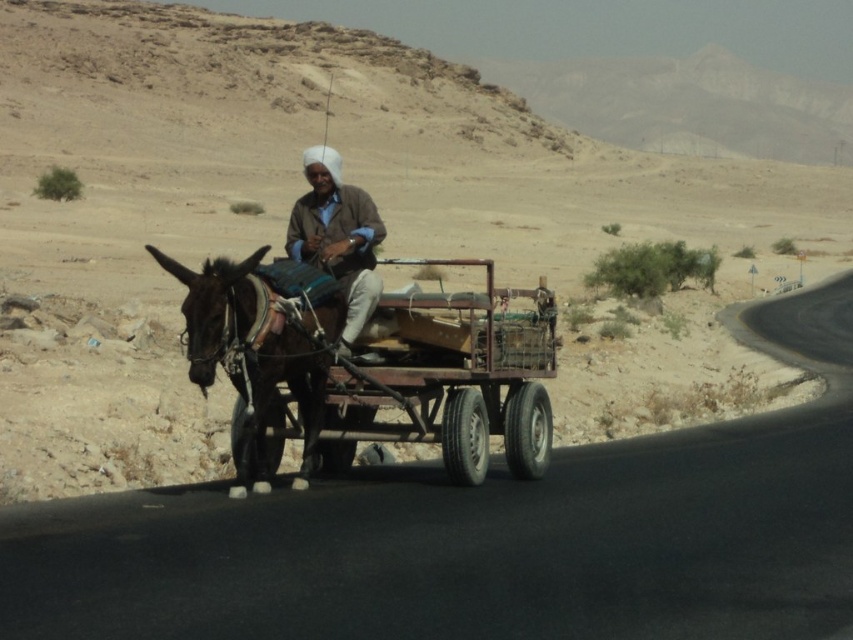
Question: Is shiny black horse at center behind brown woolen sweater at center?

Choices:
 (A) yes
 (B) no

Answer: (B)

Question: Which of these objects is positioned closest to the brown woolen sweater at center?

Choices:
 (A) rustic wooden cart at center
 (B) shiny black horse at center

Answer: (B)

Question: Can you confirm if rustic wooden cart at center is positioned to the right of brown woolen sweater at center?

Choices:
 (A) yes
 (B) no

Answer: (B)

Question: Which point appears farthest from the camera in this image?

Choices:
 (A) (239, 266)
 (B) (355, 221)
 (C) (259, 252)

Answer: (B)

Question: Estimate the real-world distances between objects in this image. Which object is closer to the shiny black horse at center?

Choices:
 (A) rustic wooden cart at center
 (B) brown woolen sweater at center

Answer: (A)

Question: Does rustic wooden cart at center appear on the left side of brown woolen sweater at center?

Choices:
 (A) yes
 (B) no

Answer: (A)